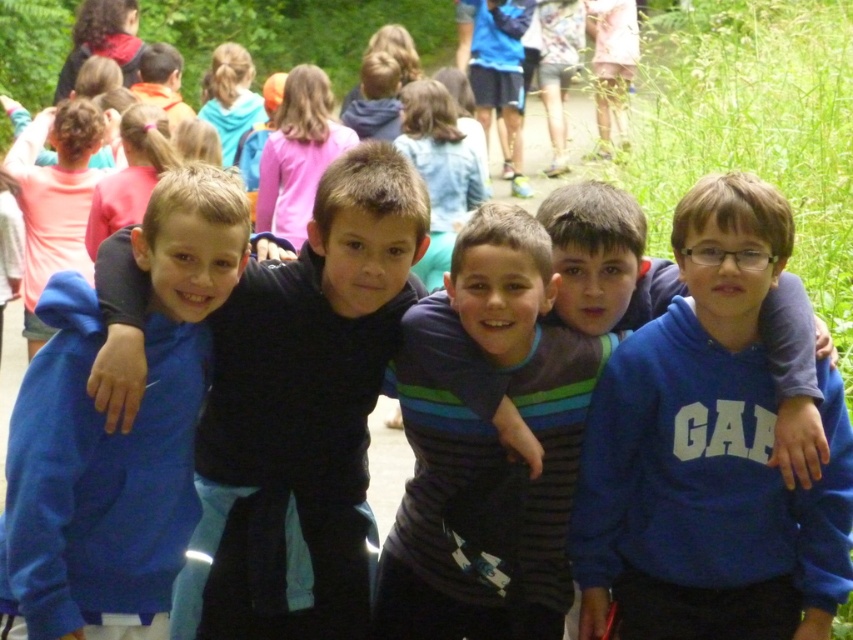
Question: Considering the real-world distances, which object is closest to the blue fleece sweatshirt at center?

Choices:
 (A) dark blue hoodie at center
 (B) blue fleece jacket at center

Answer: (A)

Question: Does dark blue hoodie at center have a smaller size compared to blue fleece jacket at center?

Choices:
 (A) no
 (B) yes

Answer: (A)

Question: Does blue fleece sweatshirt at center appear on the right side of dark blue hoodie at center?

Choices:
 (A) no
 (B) yes

Answer: (B)

Question: Which point is farther from the camera taking this photo?

Choices:
 (A) (181, 262)
 (B) (107, 392)
 (C) (822, 609)

Answer: (C)

Question: Can you confirm if blue fleece sweatshirt at center is positioned above blue fleece jacket at center?

Choices:
 (A) yes
 (B) no

Answer: (B)

Question: Which object is the closest to the dark blue hoodie at center?

Choices:
 (A) blue fleece jacket at center
 (B) blue fleece sweatshirt at center

Answer: (A)